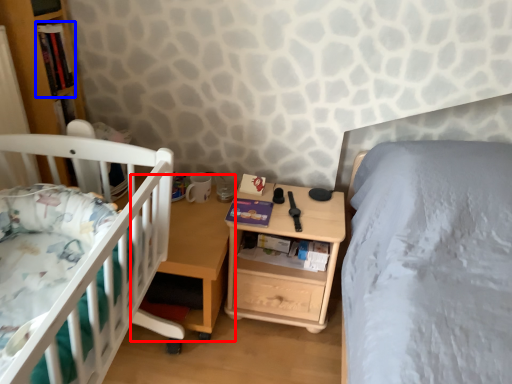
Question: Which point is further to the camera, table (highlighted by a red box) or book (highlighted by a blue box)?

Choices:
 (A) table
 (B) book

Answer: (B)